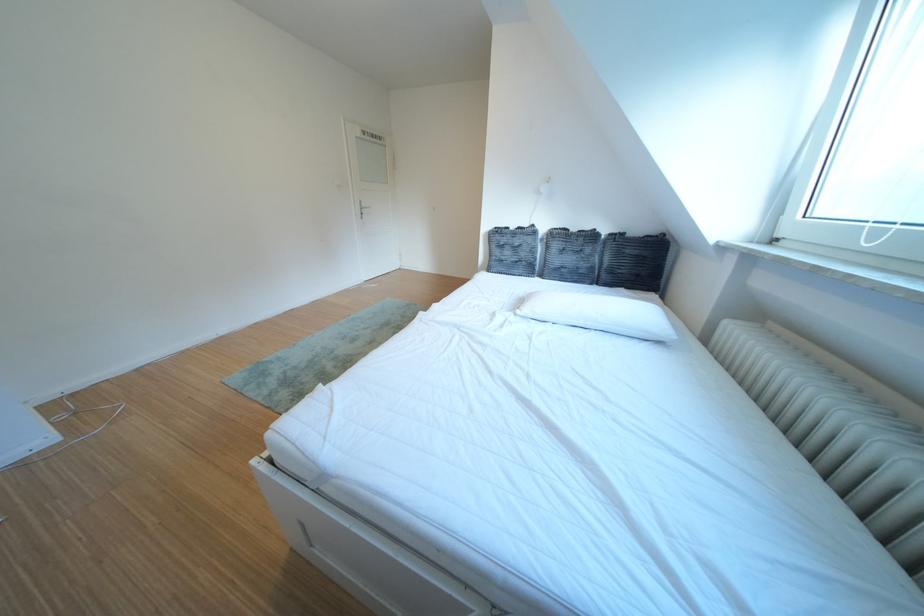
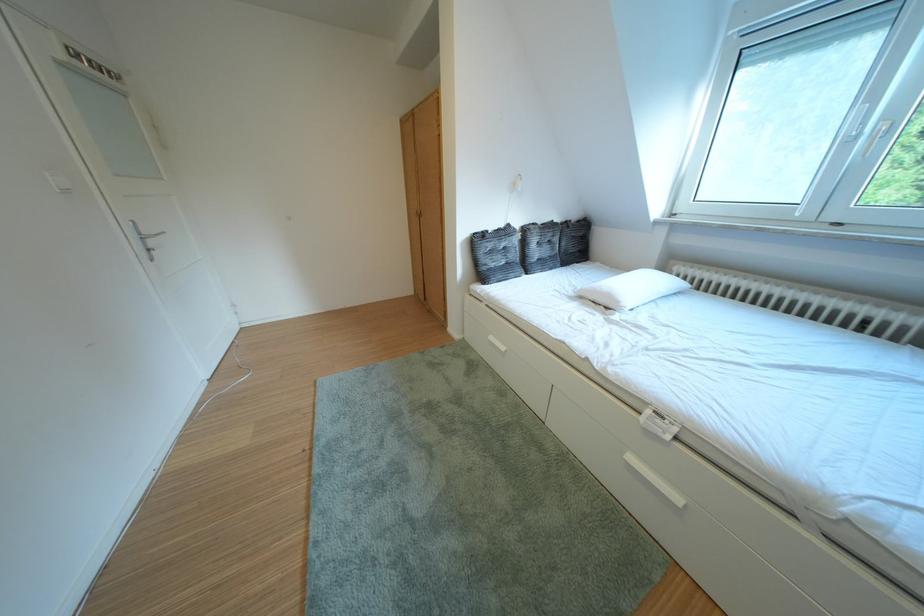
Find the pixel in the second image that matches the point at 651,235 in the first image.

(588, 222)